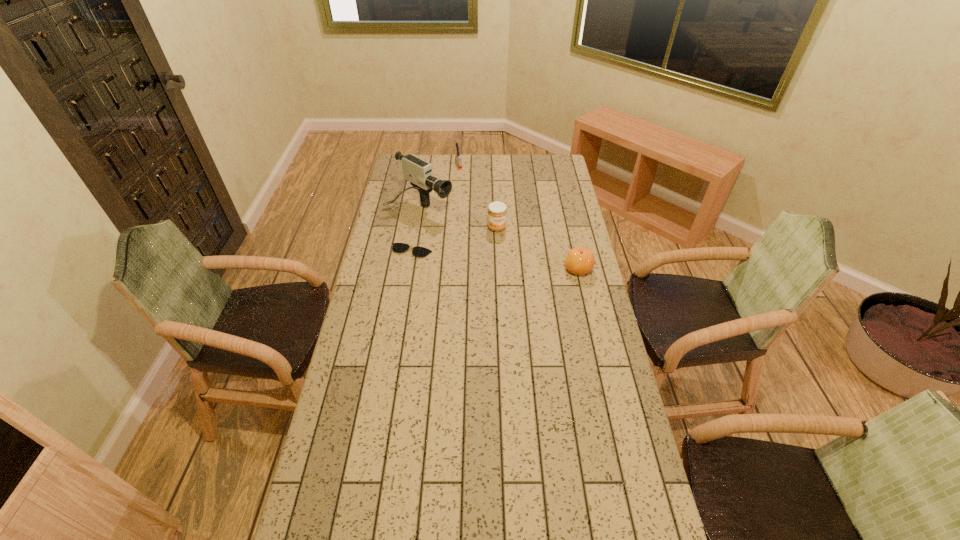
At what (x,y) coordinates should I click in order to perform the action: click on free space located 0.290m on the recording direction of the camcorder. Please return your answer as a coordinate pair (x, y). Image resolution: width=960 pixels, height=540 pixels. Looking at the image, I should click on (492, 244).

Locate an element on the screen. The image size is (960, 540). vacant space located on the recording direction of the camcorder is located at coordinates (455, 223).

This screenshot has height=540, width=960. Identify the location of vacant space located on the recording direction of the camcorder. (454, 222).

You are a GUI agent. You are given a task and a screenshot of the screen. Output one action in this format:
    pyautogui.click(x=<x>, y=<y>)
    Task: Click on the vacant area situated on the handle side of the stapler
    
    Given the screenshot: What is the action you would take?
    click(468, 195)

The width and height of the screenshot is (960, 540). In order to click on vacant space located on the handle side of the stapler in this screenshot , I will do click(468, 192).

Where is `vacant position located 0.200m on the handle side of the stapler`? vacant position located 0.200m on the handle side of the stapler is located at coordinates (467, 189).

The height and width of the screenshot is (540, 960). I want to click on vacant space located 0.340m on the front label of the jam, so click(528, 285).

Find the location of a particular element. Image resolution: width=960 pixels, height=540 pixels. vacant space located on the front label of the jam is located at coordinates (534, 294).

This screenshot has height=540, width=960. Find the location of `blank space located 0.300m on the front label of the jam`. blank space located 0.300m on the front label of the jam is located at coordinates (525, 279).

Where is `object located in the far edge section of the desktop`? object located in the far edge section of the desktop is located at coordinates (458, 157).